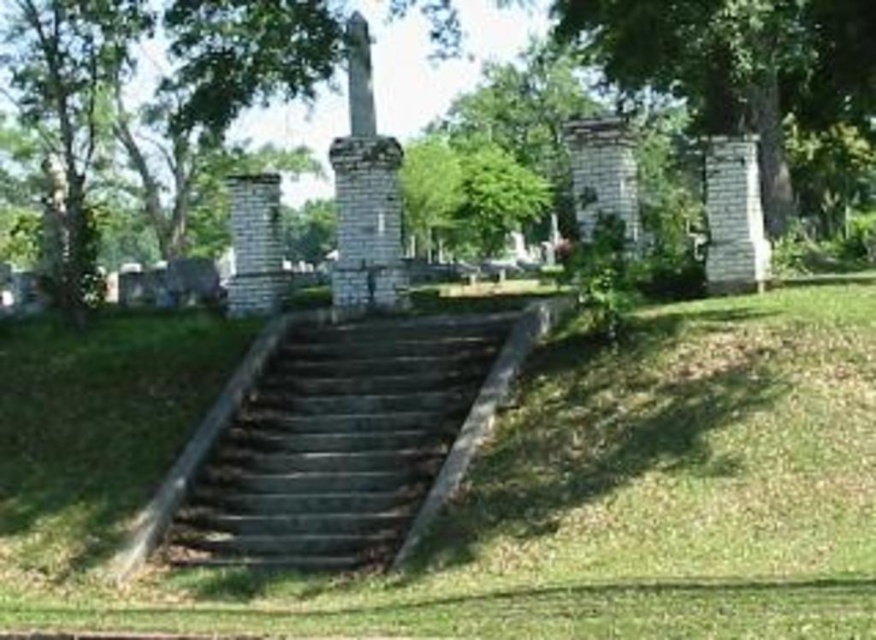
Question: Is dark gray stone stairs at center below green leafy tree at upper right?

Choices:
 (A) yes
 (B) no

Answer: (A)

Question: Is dark gray stone stairs at center further to camera compared to green leafy tree at upper right?

Choices:
 (A) no
 (B) yes

Answer: (A)

Question: Which object is closer to the camera taking this photo?

Choices:
 (A) dark gray stone stairs at center
 (B) green leafy tree at upper right

Answer: (A)

Question: Does dark gray stone stairs at center appear under green leafy tree at upper right?

Choices:
 (A) yes
 (B) no

Answer: (A)